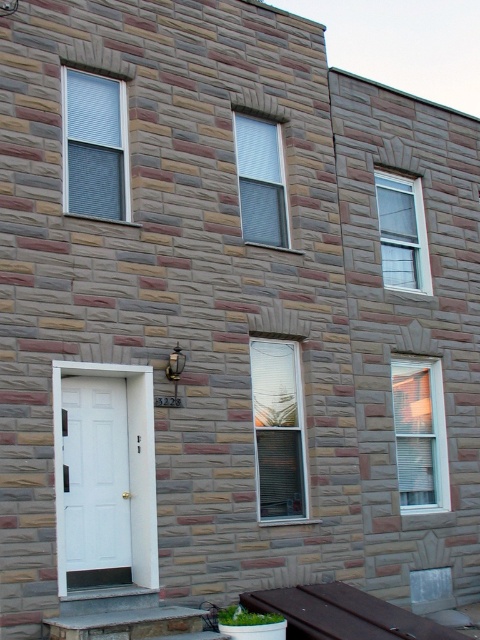
Question: Which point appears farthest from the camera in this image?

Choices:
 (A) (274, 122)
 (B) (108, 211)
 (C) (271, 458)

Answer: (A)

Question: Is white matte door at lower left below white textured window at center?

Choices:
 (A) yes
 (B) no

Answer: (A)

Question: Among these points, which one is nearest to the camera?

Choices:
 (A) (418, 380)
 (B) (420, 248)

Answer: (A)

Question: Does white plastic window at upper left appear over clear glass window at upper center?

Choices:
 (A) no
 (B) yes

Answer: (B)

Question: Can you confirm if white matte door at lower left is smaller than white plastic window at center?

Choices:
 (A) yes
 (B) no

Answer: (B)

Question: Estimate the real-world distances between objects in this image. Which object is farther from the white matte door at lower left?

Choices:
 (A) white plastic window at upper left
 (B) white plastic window at center
 (C) clear glass window at upper center

Answer: (C)